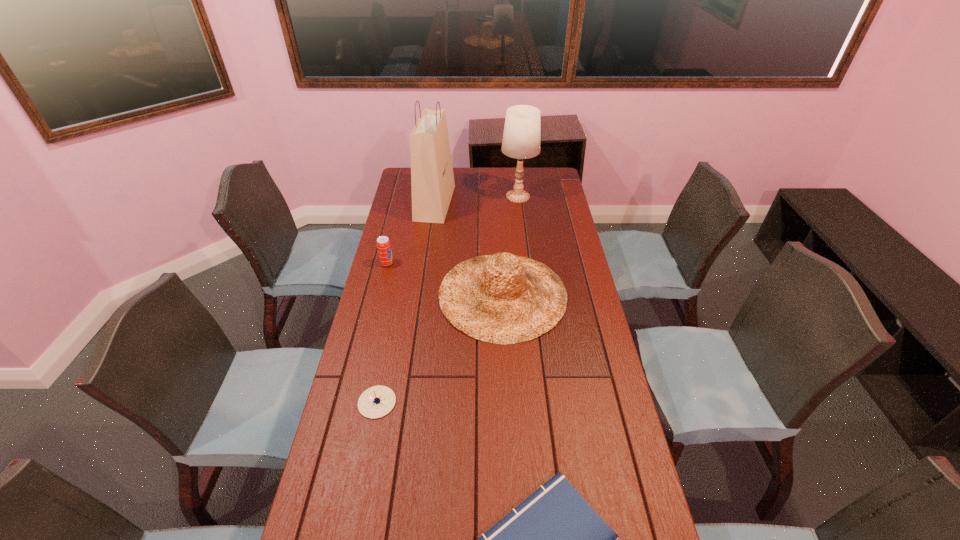
Image resolution: width=960 pixels, height=540 pixels. In the image, there is a desktop. What are the coordinates of `vacant space at the far edge` in the screenshot? It's located at (502, 170).

In the image, there is a desktop. Where is `vacant space at the left edge`? This screenshot has width=960, height=540. vacant space at the left edge is located at coordinates (408, 251).

In the image, there is a desktop. Where is `free space at the right edge`? The image size is (960, 540). free space at the right edge is located at coordinates (573, 355).

Identify the location of free space between the shopping bag and the compass. This screenshot has width=960, height=540. (406, 302).

I want to click on unoccupied area between the shopping bag and the lamp, so click(x=476, y=200).

The image size is (960, 540). Identify the location of empty space that is in between the compass and the soda can. (382, 333).

At what (x,y) coordinates should I click in order to perform the action: click on vacant area between the compass and the shopping bag. Please return your answer as a coordinate pair (x, y). Looking at the image, I should click on (406, 302).

The image size is (960, 540). Find the location of `unoccupied area between the second nearest object and the sunhat`. unoccupied area between the second nearest object and the sunhat is located at coordinates (440, 348).

This screenshot has width=960, height=540. I want to click on the fifth closest object relative to the sunhat, so click(554, 539).

Identify which object is the third nearest to the soda can. Please provide its 2D coordinates. Your answer should be formatted as a tuple, i.e. [(x, y)], where the tuple contains the x and y coordinates of a point satisfying the conditions above.

[(375, 402)]